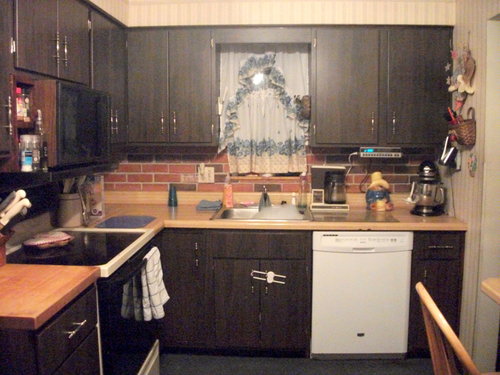
Find the location of a particular element. Image resolution: width=500 pixels, height=375 pixels. fabric is located at coordinates (154, 282), (257, 131), (238, 83), (286, 80).